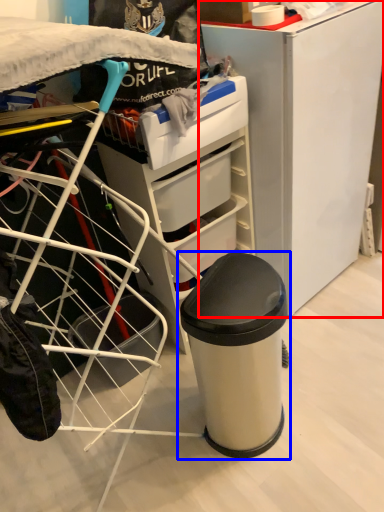
Question: Which of the following is the farthest to the observer, furniture (highlighted by a red box) or waste container (highlighted by a blue box)?

Choices:
 (A) furniture
 (B) waste container

Answer: (A)